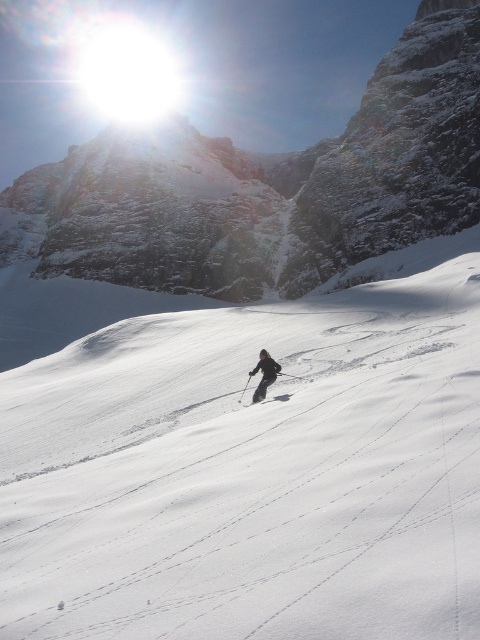
Does white powder snow at center appear on the right side of snowy rocky mountain at upper center?

Indeed, white powder snow at center is positioned on the right side of snowy rocky mountain at upper center.

Is white powder snow at center thinner than snowy rocky mountain at upper center?

Correct, white powder snow at center's width is less than snowy rocky mountain at upper center's.

Which is behind, point (226, 438) or point (193, 189)?

Positioned behind is point (193, 189).

Where is `white powder snow at center`? This screenshot has height=640, width=480. white powder snow at center is located at coordinates (252, 472).

Between black matte snowboarder at center and white matte ski at center, which one appears on the right side from the viewer's perspective?

black matte snowboarder at center

Can you confirm if black matte snowboarder at center is taller than white matte ski at center?

No.

Which is behind, point (256, 388) or point (262, 401)?

Point (256, 388)

What are the coordinates of `black matte snowboarder at center` in the screenshot? It's located at (264, 374).

Is white powder snow at center positioned at the back of white matte ski at center?

No, it is in front of white matte ski at center.

Can you confirm if white powder snow at center is positioned to the left of white matte ski at center?

Correct, you'll find white powder snow at center to the left of white matte ski at center.

Between point (249, 321) and point (243, 403), which one is positioned behind?

The point (249, 321) is more distant.

Where is `white powder snow at center`? The width and height of the screenshot is (480, 640). white powder snow at center is located at coordinates (252, 472).